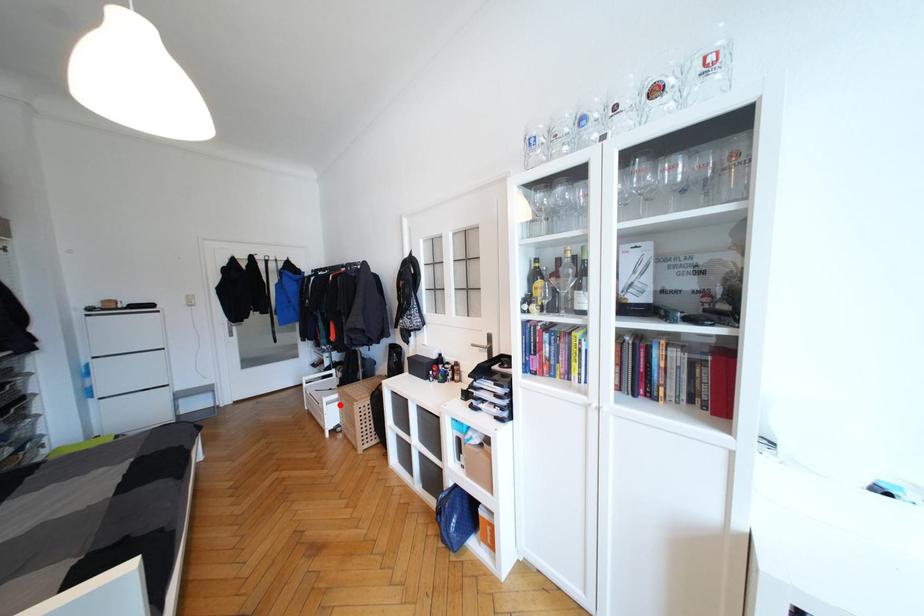
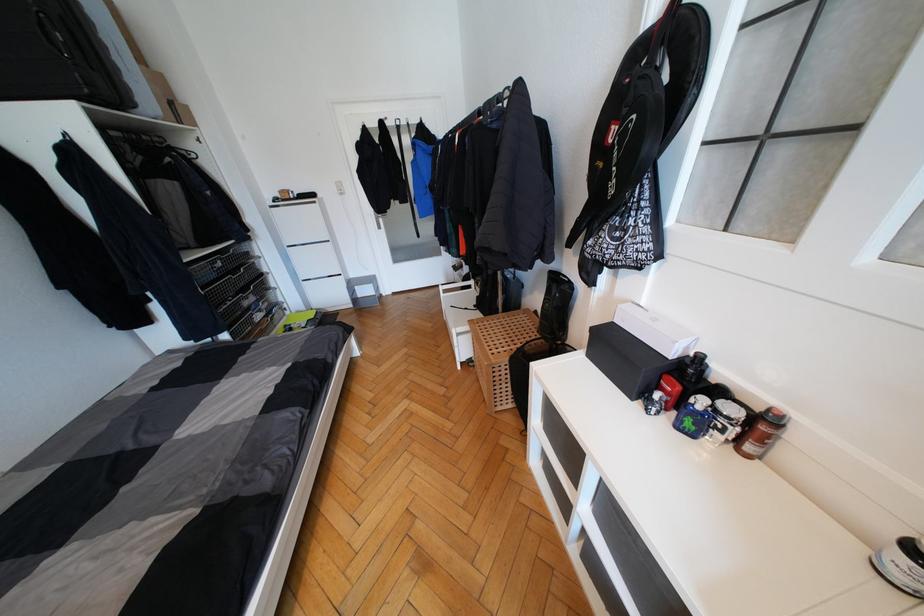
Find the pixel in the second image that matches the highlighted location in the first image.

(472, 338)